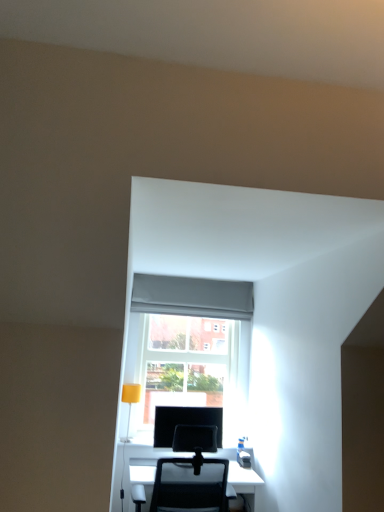
Question: Does point (145, 472) appear closer or farther from the camera than point (210, 364)?

Choices:
 (A) farther
 (B) closer

Answer: (B)

Question: From a real-world perspective, is black mesh chair at lower center above or below transparent glass door at center?

Choices:
 (A) below
 (B) above

Answer: (A)

Question: Which object is the farthest from the transparent glass door at center?

Choices:
 (A) black mesh chair at lower center
 (B) yellow matte table lamp at lower left
 (C) matte black monitor at center

Answer: (A)

Question: Which object is the farthest from the matte black monitor at center?

Choices:
 (A) transparent glass door at center
 (B) yellow matte table lamp at lower left
 (C) black mesh chair at lower center

Answer: (A)